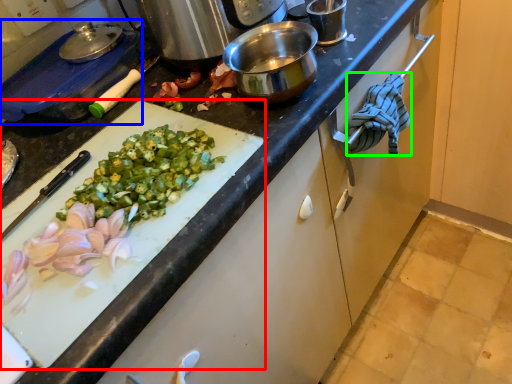
Question: Estimate the real-world distances between objects in this image. Which object is closer to cutting board (highlighted by a red box), kitchen appliance (highlighted by a blue box) or cloth (highlighted by a green box)?

Choices:
 (A) kitchen appliance
 (B) cloth

Answer: (A)